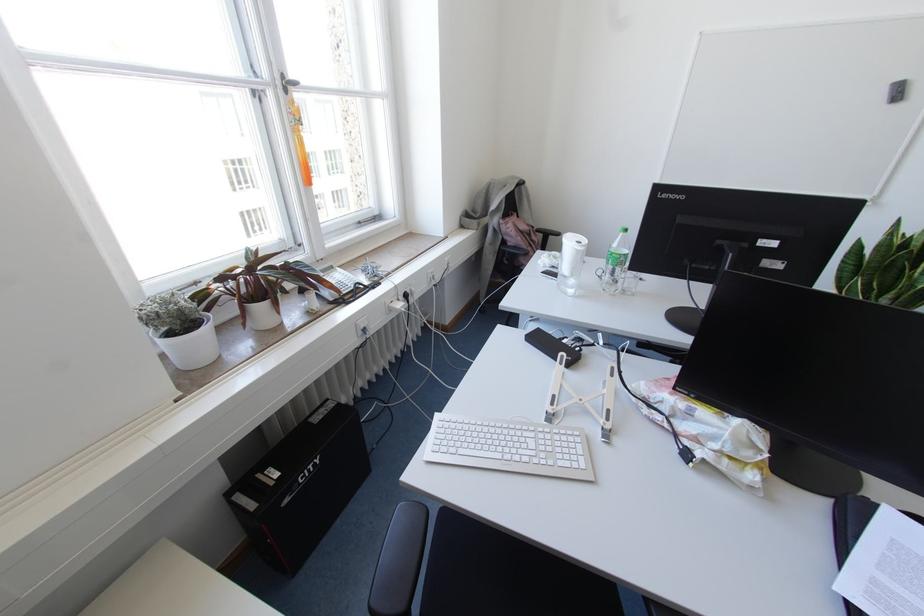
I want to click on green plastic bottle, so click(x=615, y=262).